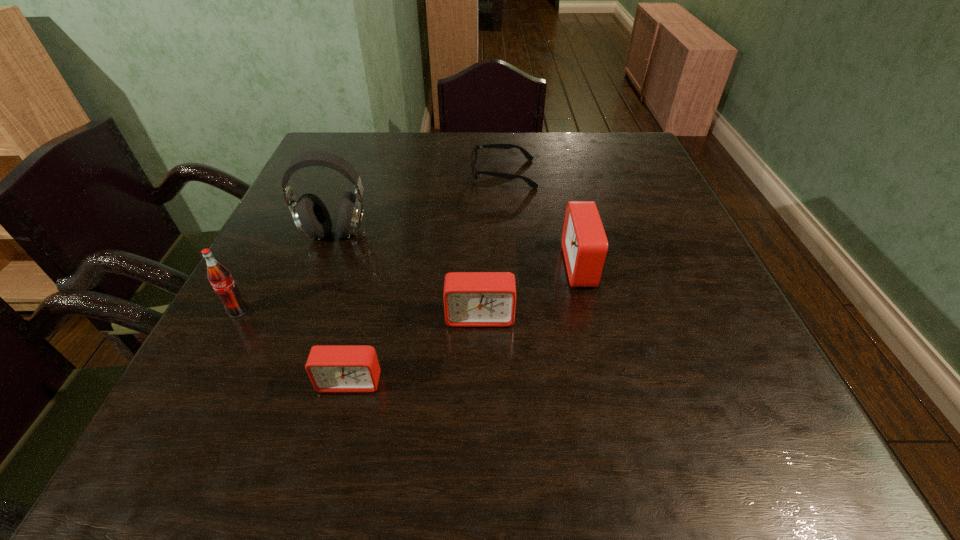
In order to click on the second shortest object in this screenshot , I will do click(x=331, y=368).

Locate an element on the screen. This screenshot has height=540, width=960. the nearest alarm clock is located at coordinates (331, 368).

Where is `the fourth tallest object`? The height and width of the screenshot is (540, 960). the fourth tallest object is located at coordinates (471, 299).

I want to click on the second farthest alarm clock, so click(x=471, y=299).

In order to click on the tallest alarm clock in this screenshot , I will do `click(584, 243)`.

Find the location of a particular element. the farthest alarm clock is located at coordinates (584, 243).

Where is `spectacles`? spectacles is located at coordinates (531, 183).

Locate an element on the screen. the farthest object is located at coordinates click(531, 183).

Image resolution: width=960 pixels, height=540 pixels. I want to click on the leftmost object, so click(x=220, y=278).

Where is `soda bottle`? This screenshot has width=960, height=540. soda bottle is located at coordinates (220, 278).